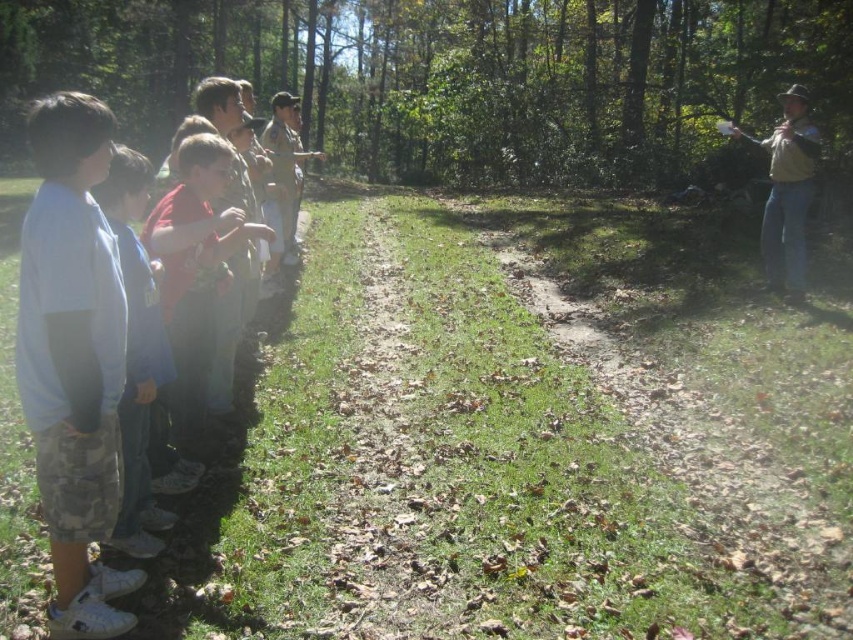
You are a photographer trying to capture a candid shot of the light blue cotton shirt at left and the blue denim jeans at left. Since you want to ensure both are fully visible in the frame, which part of the clothing items should you focus on to avoid cropping either?

The light blue cotton shirt at left is shorter than the blue denim jeans at left. To ensure both are fully visible in the frame, focus on capturing up to the height of the blue denim jeans at left, as the shirt is shorter and the jeans extend lower.

From the picture: You are a photographer standing at the center of the path. You want to take a photo that includes both the green leafy forest at upper center and the blue denim jeans at left. Which object should you focus on first to ensure both are in focus?

You should focus on the green leafy forest at upper center first because it is closer to you than the blue denim jeans at left, so adjusting focus from near to far will help both be in focus.

You are a photographer trying to capture a group photo of the children in the scene. You want to ensure that both the green leafy forest at upper center and the light blue cotton shirt at left are clearly visible in the photo. Given their sizes, which object should you focus on to ensure proper exposure and detail?

The green leafy forest at upper center has a larger size compared to the light blue cotton shirt at left. To ensure proper exposure and detail for both, focus on the larger object, the green leafy forest at upper center, as it occupies more of the frame and requires adequate lighting.